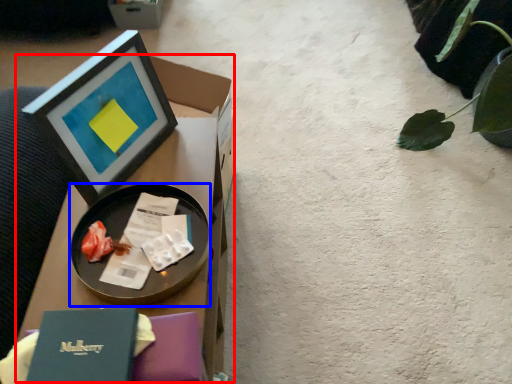
Question: Which point is further to the camera, table (highlighted by a red box) or tableware (highlighted by a blue box)?

Choices:
 (A) table
 (B) tableware

Answer: (B)